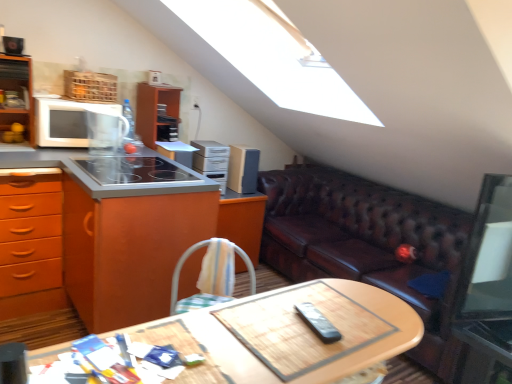
Question: Does metallic silver side table at lower right come in front of satin silver cabinet at upper center, which ranks as the third appliance in front-to-back order?

Choices:
 (A) yes
 (B) no

Answer: (A)

Question: From a real-world perspective, is metallic silver side table at lower right over satin silver cabinet at upper center, which ranks as the third appliance in front-to-back order?

Choices:
 (A) yes
 (B) no

Answer: (B)

Question: Does metallic silver side table at lower right have a greater width compared to satin silver cabinet at upper center, acting as the 2th appliance starting from the back?

Choices:
 (A) yes
 (B) no

Answer: (A)

Question: Is metallic silver side table at lower right located outside satin silver cabinet at upper center, acting as the 2th appliance starting from the back?

Choices:
 (A) no
 (B) yes

Answer: (B)

Question: Is metallic silver side table at lower right looking in the opposite direction of satin silver cabinet at upper center, which ranks as the third appliance in front-to-back order?

Choices:
 (A) no
 (B) yes

Answer: (B)

Question: Does metallic silver side table at lower right turn towards satin silver cabinet at upper center, the second appliance in the left-to-right sequence?

Choices:
 (A) no
 (B) yes

Answer: (A)

Question: Would you say wooden at center is outside orange wood cabinet at left?

Choices:
 (A) yes
 (B) no

Answer: (A)

Question: Does wooden at center have a lesser height compared to orange wood cabinet at left?

Choices:
 (A) no
 (B) yes

Answer: (B)

Question: Is the surface of wooden at center in direct contact with orange wood cabinet at left?

Choices:
 (A) yes
 (B) no

Answer: (B)

Question: Does wooden at center have a smaller size compared to orange wood cabinet at left?

Choices:
 (A) no
 (B) yes

Answer: (B)

Question: From the image's perspective, is wooden at center below orange wood cabinet at left?

Choices:
 (A) no
 (B) yes

Answer: (B)

Question: Can you confirm if wooden at center is positioned to the left of orange wood cabinet at left?

Choices:
 (A) yes
 (B) no

Answer: (B)

Question: Is metallic silver side table at lower right not within wooden at center?

Choices:
 (A) yes
 (B) no

Answer: (A)